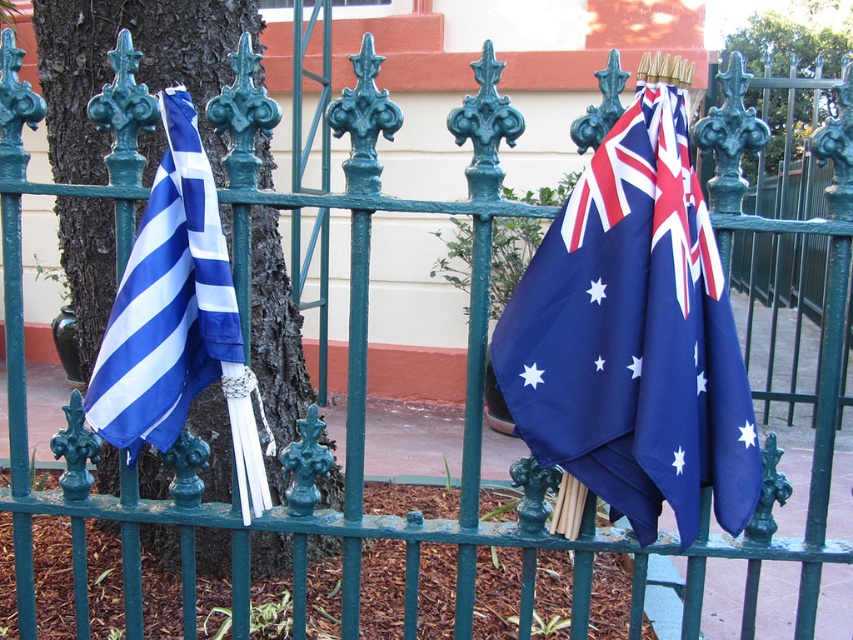
From the picture: You are standing in front of the fence with two flags. There are two points marked on the image at coordinates point [654,90] and point [109,355]. Which point is closer to you?

Point [654,90] is closer to the viewer than point [109,355].